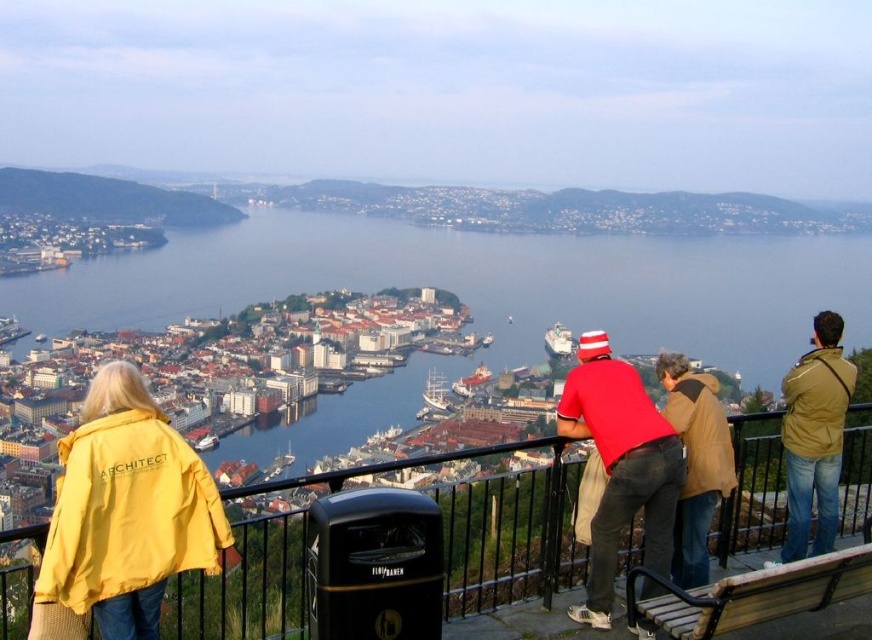
Question: From the image, what is the correct spatial relationship of brown leather jacket at right in relation to brown leather jacket at center?

Choices:
 (A) right
 (B) left

Answer: (A)

Question: Which of these objects is positioned farthest from the yellow matte jacket at lower left?

Choices:
 (A) brown leather jacket at center
 (B) khaki cotton jacket at right
 (C) blue water at center
 (D) red cotton shirt at center

Answer: (C)

Question: Is blue water at center smaller than brown leather jacket at right?

Choices:
 (A) yes
 (B) no

Answer: (B)

Question: Is black metal railing at upper center below khaki cotton jacket at right?

Choices:
 (A) no
 (B) yes

Answer: (B)

Question: Which point is farther from the camera taking this photo?

Choices:
 (A) (529, 273)
 (B) (159, 472)
 (C) (705, 493)
 (D) (800, 401)

Answer: (A)

Question: Which point appears closest to the camera in this image?

Choices:
 (A) (838, 346)
 (B) (85, 552)
 (C) (624, 486)
 (D) (460, 586)

Answer: (B)